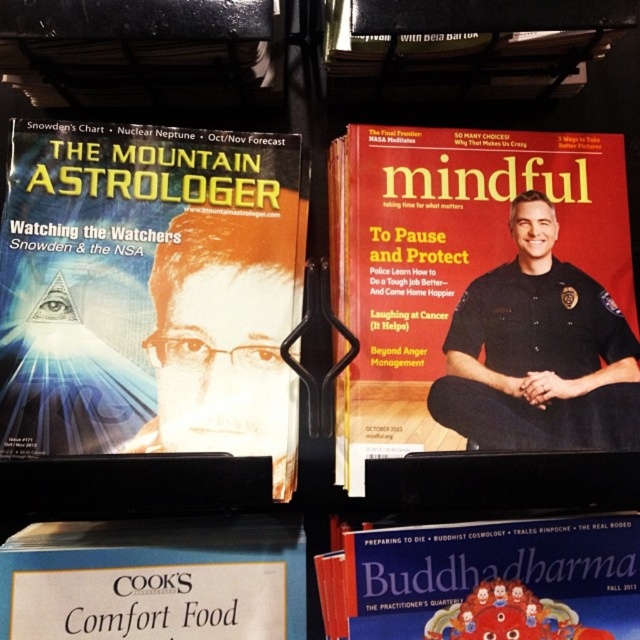
Question: Which point appears closest to the camera in this image?

Choices:
 (A) (560, 188)
 (B) (120, 545)
 (C) (604, 573)
 (D) (125, 342)

Answer: (C)

Question: Does matte black magazine at upper right lie in front of matte paper buddha dharma at center?

Choices:
 (A) yes
 (B) no

Answer: (B)

Question: Which point is farther to the camera?

Choices:
 (A) (464, 582)
 (B) (106, 596)
 (C) (68, 294)
 (D) (374, 246)

Answer: (D)

Question: Is matte black magazine at upper right bigger than white paper comfort food at lower left?

Choices:
 (A) yes
 (B) no

Answer: (A)

Question: Which of the following is the farthest from the observer?

Choices:
 (A) (152, 310)
 (B) (435, 632)

Answer: (A)

Question: From the image, what is the correct spatial relationship of matte orange magazine at left in relation to matte black magazine at upper right?

Choices:
 (A) above
 (B) below

Answer: (B)